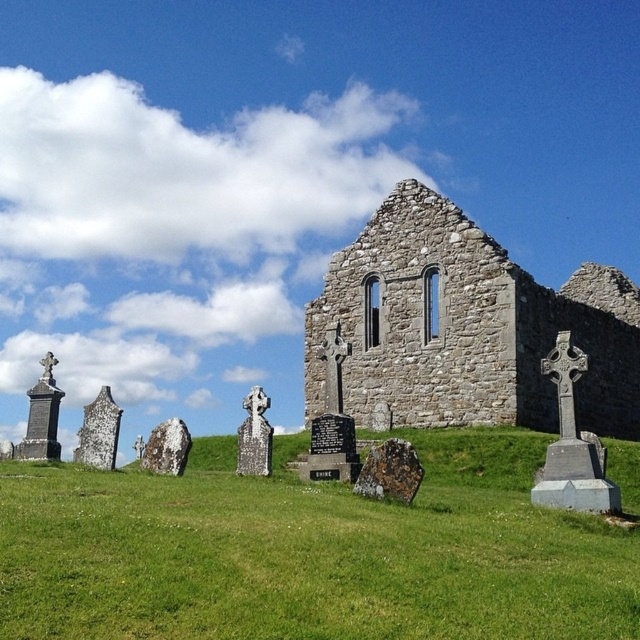
From the picture: You are a visitor at the historical site and want to take a photo of the stone wall at center and the brown stone gravestone at center. Which object is closer to you, the photographer?

The stone wall at center is positioned over the brown stone gravestone at center, so the stone wall at center is closer to you.

You are standing in front of the stone wall at center and the brown stone gravestone at center in the historical ruin. Which object is located to the left of the other?

The brown stone gravestone at center is located to the left of the stone wall at center because the stone wall at center is positioned on the right side of brown stone gravestone at center.